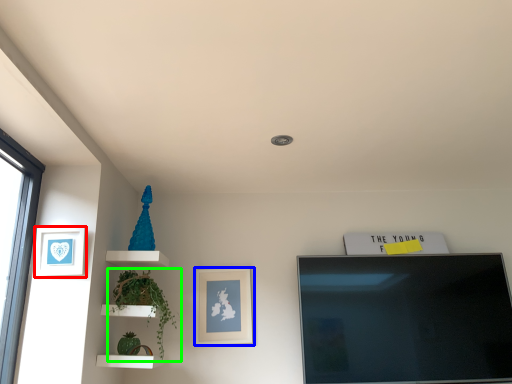
Question: Which object is positioned farthest from picture frame (highlighted by a red box)? Select from picture frame (highlighted by a blue box) and plant (highlighted by a green box).

Choices:
 (A) picture frame
 (B) plant

Answer: (A)